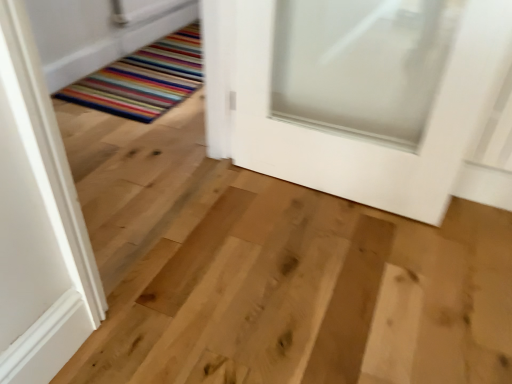
What is the approximate width of white matte door at center?

The width of white matte door at center is 19.35 centimeters.

Locate an element on the screen. Image resolution: width=512 pixels, height=384 pixels. white matte door at center is located at coordinates (371, 95).

The width and height of the screenshot is (512, 384). Describe the element at coordinates (371, 95) in the screenshot. I see `white matte door at center` at that location.

What do you see at coordinates (144, 79) in the screenshot? I see `multicolored striped rug at lower left` at bounding box center [144, 79].

Locate an element on the screen. multicolored striped rug at lower left is located at coordinates (144, 79).

The width and height of the screenshot is (512, 384). What are the coordinates of `white matte door at center` in the screenshot? It's located at (371, 95).

Is white matte door at center at the left side of multicolored striped rug at lower left?

No, white matte door at center is not to the left of multicolored striped rug at lower left.

Between white matte door at center and multicolored striped rug at lower left, which one is positioned in front?

white matte door at center is closer to the camera.

Between point (410, 111) and point (153, 82), which one is positioned in front?

The point (410, 111) is more forward.

From the image's perspective, is white matte door at center positioned above or below multicolored striped rug at lower left?

white matte door at center is situated lower than multicolored striped rug at lower left in the image.

From a real-world perspective, which object rests below the other?

From a 3D spatial view, multicolored striped rug at lower left is below.

Is white matte door at center thinner than multicolored striped rug at lower left?

Yes, white matte door at center is thinner than multicolored striped rug at lower left.

Considering the sizes of objects white matte door at center and multicolored striped rug at lower left in the image provided, who is taller, white matte door at center or multicolored striped rug at lower left?

Standing taller between the two is white matte door at center.

Between white matte door at center and multicolored striped rug at lower left, which one has larger size?

With larger size is white matte door at center.

Can we say white matte door at center lies outside multicolored striped rug at lower left?

white matte door at center lies outside multicolored striped rug at lower left's area.

Are white matte door at center and multicolored striped rug at lower left far apart?

white matte door at center is far away from multicolored striped rug at lower left.

Is white matte door at center facing towards multicolored striped rug at lower left?

No.

Where is `door above the multicolored striped rug at lower left (from a real-world perspective)`? door above the multicolored striped rug at lower left (from a real-world perspective) is located at coordinates (371, 95).

From the picture: Which object is positioned more to the right, multicolored striped rug at lower left or white matte door at center?

From the viewer's perspective, white matte door at center appears more on the right side.

Does multicolored striped rug at lower left lie behind white matte door at center?

Yes, multicolored striped rug at lower left is further from the camera.

Which is more distant, (131, 55) or (492, 10)?

Positioned behind is point (131, 55).

From the image's perspective, is multicolored striped rug at lower left located above white matte door at center?

Yes, from the image's perspective, multicolored striped rug at lower left is over white matte door at center.

From a real-world perspective, between multicolored striped rug at lower left and white matte door at center, who is vertically lower?

multicolored striped rug at lower left is physically lower.

Between multicolored striped rug at lower left and white matte door at center, which one has smaller width?

Thinner between the two is white matte door at center.

Can you confirm if multicolored striped rug at lower left is taller than white matte door at center?

No, multicolored striped rug at lower left is not taller than white matte door at center.

Does multicolored striped rug at lower left have a smaller size compared to white matte door at center?

Correct, multicolored striped rug at lower left occupies less space than white matte door at center.

In the scene shown: Which is correct: multicolored striped rug at lower left is inside white matte door at center, or outside of it?

multicolored striped rug at lower left is located beyond the bounds of white matte door at center.

Is multicolored striped rug at lower left with white matte door at center?

No, multicolored striped rug at lower left is not beside white matte door at center.

Is multicolored striped rug at lower left oriented away from white matte door at center?

No, multicolored striped rug at lower left's orientation is not away from white matte door at center.

How different are the orientations of multicolored striped rug at lower left and white matte door at center in degrees?

91.2 degrees separate the facing orientations of multicolored striped rug at lower left and white matte door at center.

How distant is multicolored striped rug at lower left from white matte door at center?

multicolored striped rug at lower left is 1.09 meters away from white matte door at center.

This screenshot has height=384, width=512. In order to click on mat located above the white matte door at center (from the image's perspective) in this screenshot , I will do `click(144, 79)`.

Locate an element on the screen. This screenshot has width=512, height=384. mat directly beneath the white matte door at center (from a real-world perspective) is located at coordinates (144, 79).

The width and height of the screenshot is (512, 384). In order to click on door in front of the multicolored striped rug at lower left in this screenshot , I will do `click(371, 95)`.